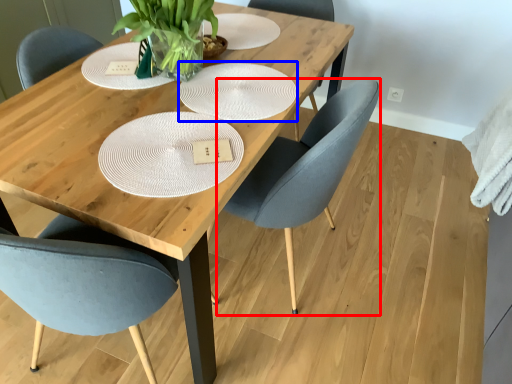
Question: Which object is further to the camera taking this photo, chair (highlighted by a red box) or plate (highlighted by a blue box)?

Choices:
 (A) chair
 (B) plate

Answer: (B)